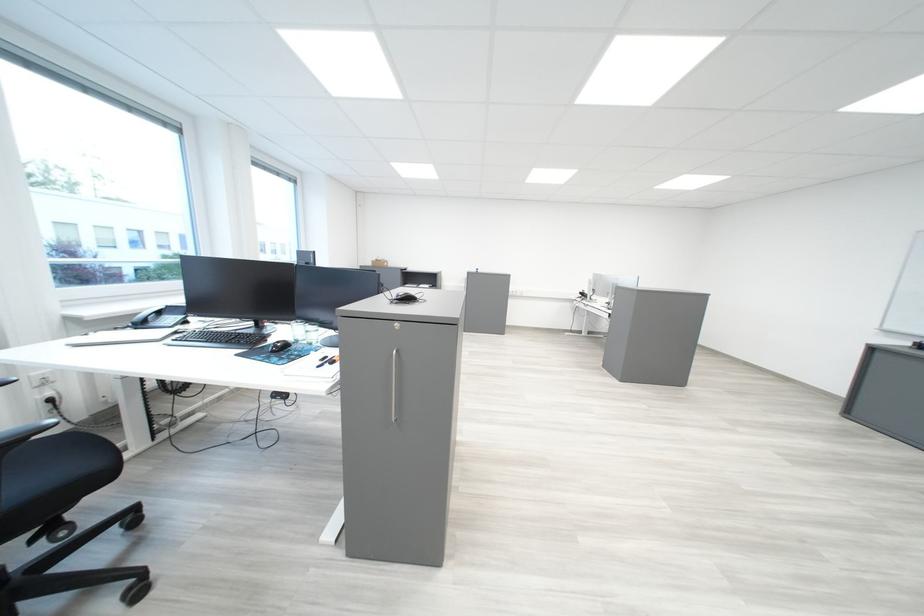
This screenshot has width=924, height=616. Identify the location of chair sitting surface. (38, 483).